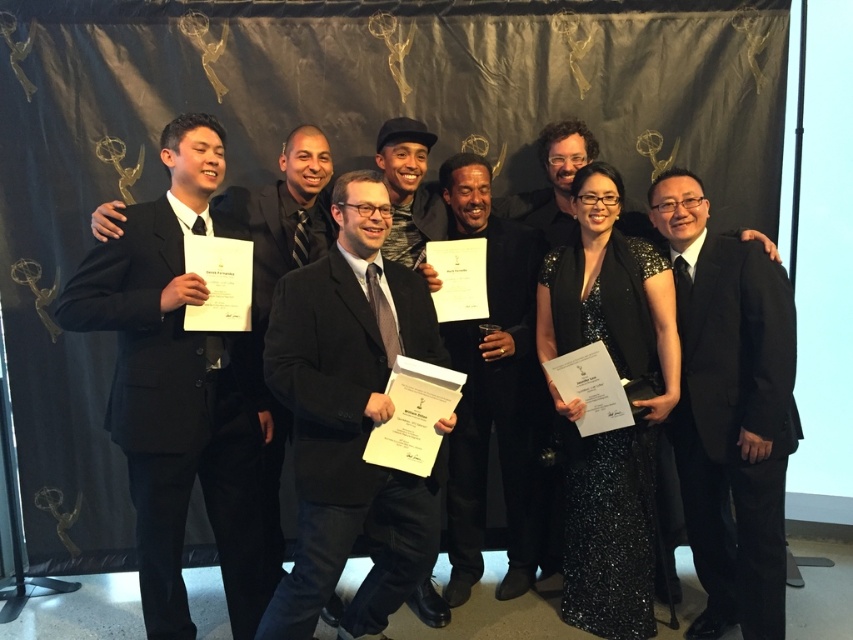
You are a photographer at the awards ceremony and need to adjust the lighting for the black shiny suit at right and the black sequined dress at center. Since both are black, you want to ensure they reflect light differently. Which one is positioned to your right?

The black shiny suit at right is to the right of the black sequined dress at center, so the black shiny suit at right is positioned to your right.

You are standing in front of the awards ceremony backdrop and see the matte black suit at center and the black matte suit at left. Which one is nearer to you?

The matte black suit at center is closer to the viewer than the black matte suit at left.